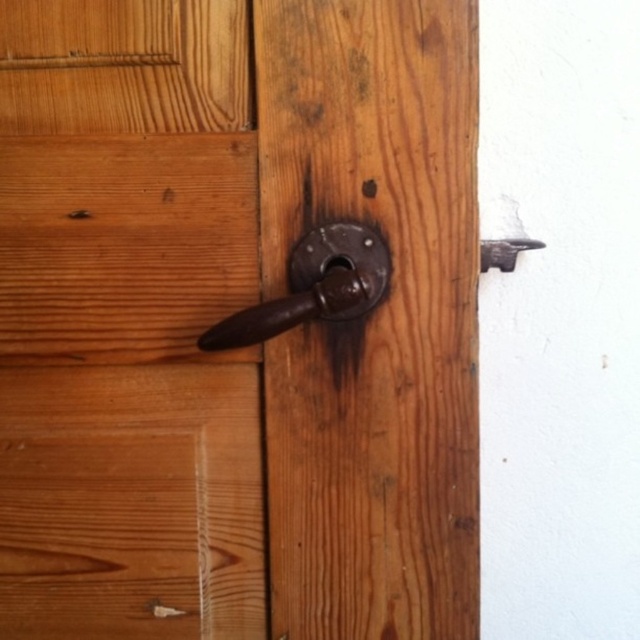
You are trying to open the door shown in the image. Where is the polished dark brown handle at center located on the door?

The polished dark brown handle at center is located at point coordinates of approximately 0.448 on the x axis and 0.491 on the y axis.